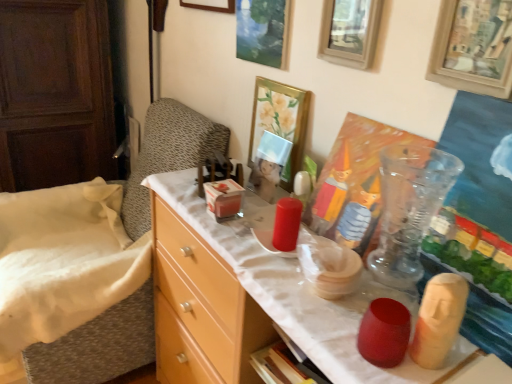
Question: Is wooden picture frame at upper center, the 4th picture frame from the left, smaller than gold metallic picture frame at upper center, which ranks as the third picture frame in right-to-left order?

Choices:
 (A) yes
 (B) no

Answer: (A)

Question: Considering the relative sizes of wooden picture frame at upper center, the 4th picture frame from the left, and gold metallic picture frame at upper center, which ranks as the third picture frame in right-to-left order, in the image provided, is wooden picture frame at upper center, the 4th picture frame from the left, shorter than gold metallic picture frame at upper center, which ranks as the third picture frame in right-to-left order,?

Choices:
 (A) no
 (B) yes

Answer: (B)

Question: Is wooden picture frame at upper center, the 4th picture frame from the left, with gold metallic picture frame at upper center, which ranks as the 3th picture frame in left-to-right order?

Choices:
 (A) no
 (B) yes

Answer: (A)

Question: Is wooden picture frame at upper center, which is the second picture frame from right to left, not within gold metallic picture frame at upper center, which ranks as the 3th picture frame in left-to-right order?

Choices:
 (A) no
 (B) yes

Answer: (B)

Question: Can you confirm if wooden picture frame at upper center, the 4th picture frame from the left, is taller than gold metallic picture frame at upper center, which ranks as the 3th picture frame in left-to-right order?

Choices:
 (A) yes
 (B) no

Answer: (B)

Question: Does wooden picture frame at upper center, which is the second picture frame from right to left, appear on the right side of gold metallic picture frame at upper center, which ranks as the 3th picture frame in left-to-right order?

Choices:
 (A) yes
 (B) no

Answer: (A)

Question: Is light wood dresser at left further to the viewer compared to light wood dresser at left?

Choices:
 (A) yes
 (B) no

Answer: (B)

Question: Is light wood dresser at left at the left side of light wood dresser at left?

Choices:
 (A) no
 (B) yes

Answer: (A)

Question: Does light wood dresser at left have a greater width compared to light wood dresser at left?

Choices:
 (A) yes
 (B) no

Answer: (A)

Question: Considering the relative sizes of light wood dresser at left and light wood dresser at left in the image provided, is light wood dresser at left shorter than light wood dresser at left?

Choices:
 (A) yes
 (B) no

Answer: (A)

Question: From a real-world perspective, is light wood dresser at left positioned over light wood dresser at left based on gravity?

Choices:
 (A) yes
 (B) no

Answer: (B)

Question: Does light wood dresser at left turn towards light wood dresser at left?

Choices:
 (A) no
 (B) yes

Answer: (A)

Question: Considering the relative positions of light wood dresser at left and light wood dresser at left in the image provided, is light wood dresser at left to the right of light wood dresser at left from the viewer's perspective?

Choices:
 (A) yes
 (B) no

Answer: (B)